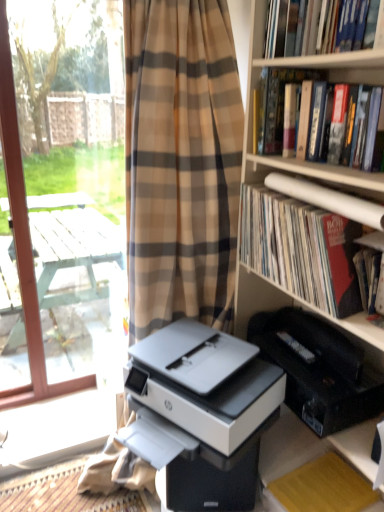
Question: Should I look upward or downward to see matte paper book at right, which is the third book in top-to-bottom order?

Choices:
 (A) up
 (B) down

Answer: (A)

Question: Considering the relative positions of yellow paper at lower right and matte paper book at right, which is the first book in bottom-to-top order, in the image provided, is yellow paper at lower right in front of matte paper book at right, which is the first book in bottom-to-top order,?

Choices:
 (A) no
 (B) yes

Answer: (A)

Question: Is yellow paper at lower right further to camera compared to matte paper book at right, which is the third book in top-to-bottom order?

Choices:
 (A) no
 (B) yes

Answer: (B)

Question: Is yellow paper at lower right not near matte paper book at right, which is the third book in top-to-bottom order?

Choices:
 (A) yes
 (B) no

Answer: (B)

Question: Is yellow paper at lower right directly adjacent to matte paper book at right, which is the first book in bottom-to-top order?

Choices:
 (A) no
 (B) yes

Answer: (A)

Question: From the image's perspective, is yellow paper at lower right above matte paper book at right, which is the first book in bottom-to-top order?

Choices:
 (A) yes
 (B) no

Answer: (B)

Question: Could you tell me if yellow paper at lower right is turned towards matte paper book at right, which is the first book in bottom-to-top order?

Choices:
 (A) no
 (B) yes

Answer: (A)

Question: From the image's perspective, is hardcover book at upper right, arranged as the 3th book when ordered from the bottom, above matte paper book at right, which is the third book in top-to-bottom order?

Choices:
 (A) yes
 (B) no

Answer: (A)

Question: Considering the relative positions of hardcover book at upper right, arranged as the 3th book when ordered from the bottom, and matte paper book at right, which is the first book in bottom-to-top order, in the image provided, is hardcover book at upper right, arranged as the 3th book when ordered from the bottom, to the left of matte paper book at right, which is the first book in bottom-to-top order, from the viewer's perspective?

Choices:
 (A) yes
 (B) no

Answer: (B)

Question: Can you confirm if hardcover book at upper right, arranged as the 3th book when ordered from the bottom, is smaller than matte paper book at right, which is the third book in top-to-bottom order?

Choices:
 (A) yes
 (B) no

Answer: (A)

Question: Does hardcover book at upper right, arranged as the 3th book when ordered from the bottom, appear on the right side of matte paper book at right, which is the first book in bottom-to-top order?

Choices:
 (A) no
 (B) yes

Answer: (B)

Question: Does hardcover book at upper right, arranged as the 3th book when ordered from the bottom, come behind matte paper book at right, which is the third book in top-to-bottom order?

Choices:
 (A) no
 (B) yes

Answer: (A)

Question: Does hardcover book at upper right, positioned as the first book in top-to-bottom order, have a larger size compared to matte paper book at right, which is the third book in top-to-bottom order?

Choices:
 (A) no
 (B) yes

Answer: (A)

Question: Considering the relative positions of matte paper book at right, which is the third book in top-to-bottom order, and white wood screen door at left in the image provided, is matte paper book at right, which is the third book in top-to-bottom order, in front of white wood screen door at left?

Choices:
 (A) no
 (B) yes

Answer: (B)